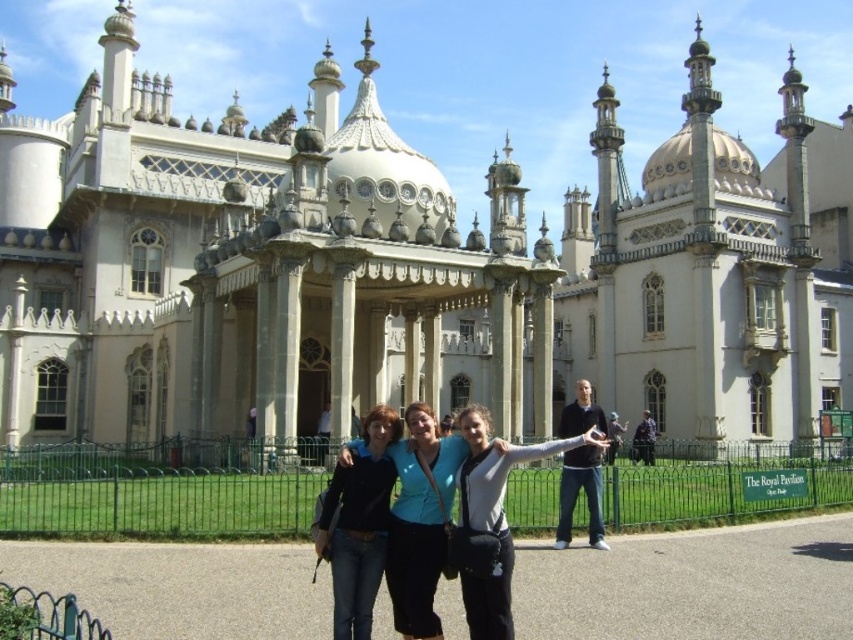
Question: Which point appears closest to the camera in this image?

Choices:
 (A) (601, 516)
 (B) (419, 461)

Answer: (B)

Question: Which point is farther from the camera taking this photo?

Choices:
 (A) (357, 630)
 (B) (113, 240)
 (C) (584, 480)

Answer: (B)

Question: Is matte black jacket at center bigger than dark brown sweater at center?

Choices:
 (A) yes
 (B) no

Answer: (B)

Question: Estimate the real-world distances between objects in this image. Which object is closer to the matte blue shirt at center?

Choices:
 (A) dark brown sweater at center
 (B) white stone palace at center
 (C) black fabric jacket at center
 (D) matte black jacket at center

Answer: (D)

Question: Is matte blue shirt at center wider than dark brown sweater at center?

Choices:
 (A) no
 (B) yes

Answer: (A)

Question: From the image, what is the correct spatial relationship of black fabric jacket at center in relation to matte black jacket at center?

Choices:
 (A) below
 (B) above

Answer: (B)